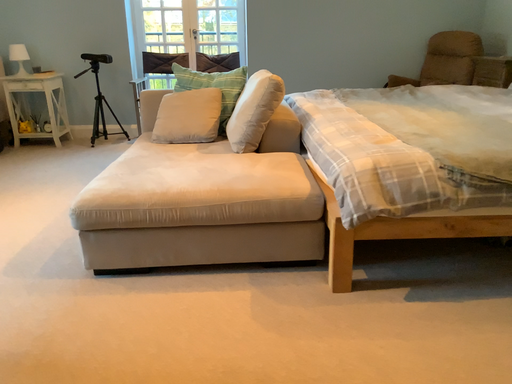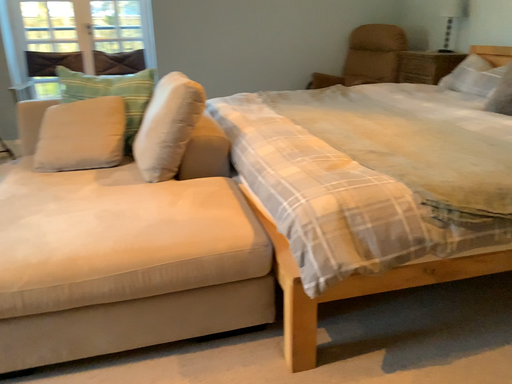
Question: Which way did the camera rotate in the video?

Choices:
 (A) rotated right
 (B) rotated left

Answer: (A)